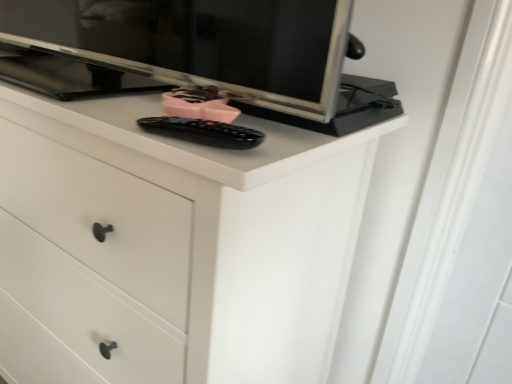
Where is `white matte chest of drawers at center`? The width and height of the screenshot is (512, 384). white matte chest of drawers at center is located at coordinates (181, 240).

What do you see at coordinates (181, 240) in the screenshot? The height and width of the screenshot is (384, 512). I see `white matte chest of drawers at center` at bounding box center [181, 240].

Where is `black plastic remote at center`? This screenshot has height=384, width=512. black plastic remote at center is located at coordinates (203, 132).

Image resolution: width=512 pixels, height=384 pixels. What do you see at coordinates (203, 132) in the screenshot?
I see `black plastic remote at center` at bounding box center [203, 132].

Locate an element on the screen. white matte chest of drawers at center is located at coordinates (181, 240).

Between black plastic remote at center and white matte chest of drawers at center, which one appears on the left side from the viewer's perspective?

From the viewer's perspective, white matte chest of drawers at center appears more on the left side.

In the image, is black plastic remote at center positioned in front of or behind white matte chest of drawers at center?

black plastic remote at center is behind white matte chest of drawers at center.

Is point (206, 144) farther from viewer compared to point (79, 160)?

No.

From the image's perspective, is black plastic remote at center over white matte chest of drawers at center?

Yes.

From a real-world perspective, is black plastic remote at center on white matte chest of drawers at center?

Yes, from a real-world perspective, black plastic remote at center is above white matte chest of drawers at center.

Considering the sizes of objects black plastic remote at center and white matte chest of drawers at center in the image provided, who is wider, black plastic remote at center or white matte chest of drawers at center?

Wider between the two is white matte chest of drawers at center.

Considering the sizes of black plastic remote at center and white matte chest of drawers at center in the image, is black plastic remote at center taller or shorter than white matte chest of drawers at center?

Clearly, black plastic remote at center is shorter compared to white matte chest of drawers at center.

Based on the photo, can you confirm if black plastic remote at center is bigger than white matte chest of drawers at center?

No.

Which is correct: black plastic remote at center is inside white matte chest of drawers at center, or outside of it?

black plastic remote at center lies within the bounds of white matte chest of drawers at center.

Is black plastic remote at center far away from white matte chest of drawers at center?

No, black plastic remote at center is in close proximity to white matte chest of drawers at center.

Could you tell me if black plastic remote at center is facing white matte chest of drawers at center?

No, black plastic remote at center is not aimed at white matte chest of drawers at center.

How far apart are black plastic remote at center and white matte chest of drawers at center?

11.16 inches.

Image resolution: width=512 pixels, height=384 pixels. I want to click on control above the white matte chest of drawers at center (from the image's perspective), so click(203, 132).

Considering the relative positions of white matte chest of drawers at center and black plastic remote at center in the image provided, is white matte chest of drawers at center to the left or to the right of black plastic remote at center?

white matte chest of drawers at center is positioned on black plastic remote at center's left side.

Is white matte chest of drawers at center behind black plastic remote at center?

No, white matte chest of drawers at center is closer to the camera.

Which is less distant, (35, 248) or (159, 128)?

Point (35, 248).

From the image's perspective, between white matte chest of drawers at center and black plastic remote at center, who is located below?

white matte chest of drawers at center is shown below in the image.

From a real-world perspective, who is located lower, white matte chest of drawers at center or black plastic remote at center?

white matte chest of drawers at center is physically lower.

Does white matte chest of drawers at center have a lesser width compared to black plastic remote at center?

No.

Considering the relative sizes of white matte chest of drawers at center and black plastic remote at center in the image provided, is white matte chest of drawers at center shorter than black plastic remote at center?

No.

Can you confirm if white matte chest of drawers at center is bigger than black plastic remote at center?

Yes, white matte chest of drawers at center is bigger than black plastic remote at center.

Choose the correct answer: Is white matte chest of drawers at center inside black plastic remote at center or outside it?

white matte chest of drawers at center is outside black plastic remote at center.

Is there a large distance between white matte chest of drawers at center and black plastic remote at center?

That's not correct — white matte chest of drawers at center is a little close to black plastic remote at center.

Is white matte chest of drawers at center facing towards black plastic remote at center?

No, white matte chest of drawers at center is not oriented towards black plastic remote at center.

Can you tell me how much white matte chest of drawers at center and black plastic remote at center differ in facing direction?

There is a 0.319-degree angle between the facing directions of white matte chest of drawers at center and black plastic remote at center.

Where is `chest of drawers in front of the black plastic remote at center`? The image size is (512, 384). chest of drawers in front of the black plastic remote at center is located at coordinates (181, 240).

This screenshot has width=512, height=384. I want to click on control on the right side of white matte chest of drawers at center, so pos(203,132).

Locate an element on the screen. This screenshot has width=512, height=384. control above the white matte chest of drawers at center (from the image's perspective) is located at coordinates (203, 132).